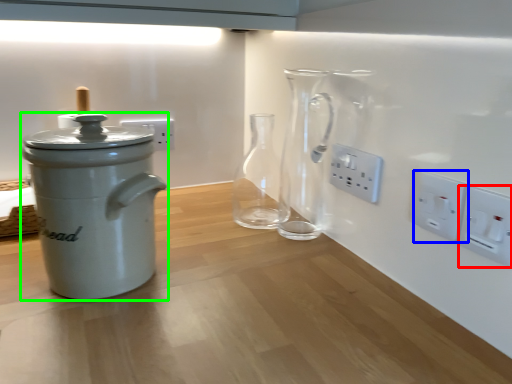
Question: Which object is positioned closest to electric outlet (highlighted by a red box)? Select from electric outlet (highlighted by a blue box) and kitchen appliance (highlighted by a green box).

Choices:
 (A) electric outlet
 (B) kitchen appliance

Answer: (A)